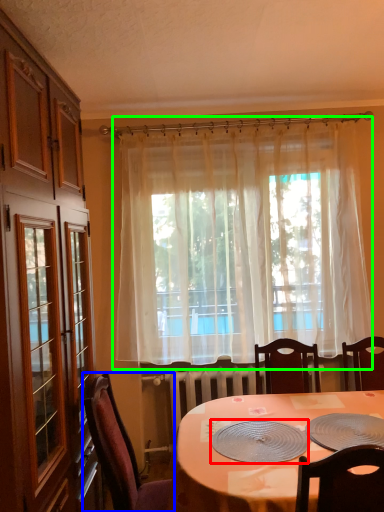
Question: Considering the real-world distances, which object is closest to platter (highlighted by a red box)? chair (highlighted by a blue box) or curtain (highlighted by a green box).

Choices:
 (A) chair
 (B) curtain

Answer: (A)